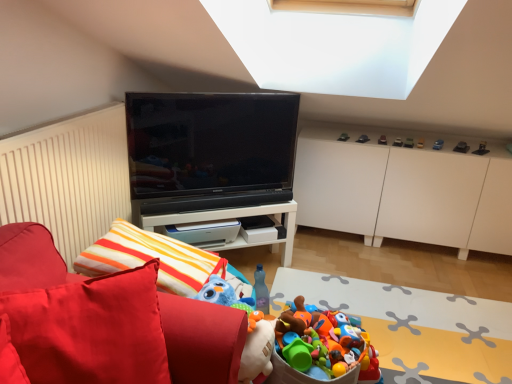
The height and width of the screenshot is (384, 512). Describe the element at coordinates (326, 344) in the screenshot. I see `plastic toy bucket at lower center, the 1th toy positioned from the bottom` at that location.

I want to click on metallic car at upper right, the fifth toy viewed from the right, so click(x=408, y=143).

You are a GUI agent. You are given a task and a screenshot of the screen. Output one action in this format:
    pyautogui.click(x=<x>, y=<y>)
    Task: Click on the metallic silver toy car at upper right, which appears as the ninth toy when ordered from the bottom
    
    Given the screenshot: What is the action you would take?
    pyautogui.click(x=382, y=140)

Where is `white glossy table at center`? This screenshot has width=512, height=384. white glossy table at center is located at coordinates click(233, 218).

The width and height of the screenshot is (512, 384). I want to click on plush blue at center, which appears as the eleventh toy when viewed from the right, so click(x=248, y=321).

Where is `plastic toy bucket at lower center, the 2th toy positioned from the left`? The height and width of the screenshot is (384, 512). plastic toy bucket at lower center, the 2th toy positioned from the left is located at coordinates (326, 344).

Would you say plastic toy bucket at lower center, which is counted as the eleventh toy, starting from the top, is to the left or to the right of metallic red car at upper right, positioned as the 4th toy in top-to-bottom order, in the picture?

In the image, plastic toy bucket at lower center, which is counted as the eleventh toy, starting from the top, appears on the left side of metallic red car at upper right, positioned as the 4th toy in top-to-bottom order.

Can you confirm if plastic toy bucket at lower center, which is counted as the eleventh toy, starting from the top, is wider than metallic red car at upper right, which is the 8th toy from bottom to top?

Indeed, plastic toy bucket at lower center, which is counted as the eleventh toy, starting from the top, has a greater width compared to metallic red car at upper right, which is the 8th toy from bottom to top.

Is plastic toy bucket at lower center, the 1th toy positioned from the bottom, turned away from metallic red car at upper right, arranged as the 6th toy when viewed from the right?

No.

Is plastic toy bucket at lower center, which is the tenth toy in right-to-left order, not close to metallic red car at upper right, arranged as the 6th toy when viewed from the right?

Absolutely, plastic toy bucket at lower center, which is the tenth toy in right-to-left order, is distant from metallic red car at upper right, arranged as the 6th toy when viewed from the right.

From the image's perspective, which one is positioned lower, black glossy tv at center or metallic red car at upper right, positioned as the 4th toy in top-to-bottom order?

From the image's view, black glossy tv at center is below.

From a real-world perspective, starting from the black glossy tv at center, which toy is the 9th one below it? Please provide its 2D coordinates.

[(398, 142)]

From a real-world perspective, is black glossy tv at center on metallic red car at upper right, positioned as the 4th toy in top-to-bottom order?

Indeed, from a real-world perspective, black glossy tv at center stands above metallic red car at upper right, positioned as the 4th toy in top-to-bottom order.

Which of these two, black glossy tv at center or metallic red car at upper right, which is the 8th toy from bottom to top, stands shorter?

metallic red car at upper right, which is the 8th toy from bottom to top.

Choose the correct answer: Is metallic blue car at upper right, marked as the 7th toy in a top-to-bottom arrangement, inside metallic gold car at upper right, which is counted as the 8th toy, starting from the left, or outside it?

metallic blue car at upper right, marked as the 7th toy in a top-to-bottom arrangement, is not inside metallic gold car at upper right, which is counted as the 8th toy, starting from the left, it's outside.

Is point (442, 145) behind point (418, 147)?

Yes, point (442, 145) is farther from viewer.

Considering the relative sizes of metallic blue car at upper right, positioned as the ninth toy in left-to-right order, and metallic gold car at upper right, which is counted as the 8th toy, starting from the left, in the image provided, is metallic blue car at upper right, positioned as the ninth toy in left-to-right order, taller than metallic gold car at upper right, which is counted as the 8th toy, starting from the left,?

Indeed, metallic blue car at upper right, positioned as the ninth toy in left-to-right order, has a greater height compared to metallic gold car at upper right, which is counted as the 8th toy, starting from the left.

Is metallic silver toy car at upper right, the eleventh toy when ordered from bottom to top, completely or partially inside plush blue at center, which appears as the eleventh toy when viewed from the right?

No, plush blue at center, which appears as the eleventh toy when viewed from the right, does not contain metallic silver toy car at upper right, the eleventh toy when ordered from bottom to top.

Looking at the image, does plush blue at center, which is the 2th toy from bottom to top, seem bigger or smaller compared to metallic silver toy car at upper right, which appears as the 1th toy when viewed from the top?

Considering their sizes, plush blue at center, which is the 2th toy from bottom to top, takes up more space than metallic silver toy car at upper right, which appears as the 1th toy when viewed from the top.

Does point (265, 341) lie behind point (341, 135)?

No.

Which object is closer to the camera taking this photo, plush blue at center, which appears as the eleventh toy when viewed from the right, or metallic silver toy car at upper right, which appears as the 1th toy when viewed from the top?

plush blue at center, which appears as the eleventh toy when viewed from the right, is closer to the camera.

Is point (439, 147) positioned in front of point (362, 141)?

Yes, it is.

Can you see metallic blue car at upper right, the 3th toy when ordered from right to left, touching metallic car at upper center, which is the 4th toy from left to right?

No, metallic blue car at upper right, the 3th toy when ordered from right to left, is not with metallic car at upper center, which is the 4th toy from left to right.

From a real-world perspective, is metallic blue car at upper right, the 3th toy when ordered from right to left, located beneath metallic car at upper center, which is the second toy from top to bottom?

No, from a real-world perspective, metallic blue car at upper right, the 3th toy when ordered from right to left, is not beneath metallic car at upper center, which is the second toy from top to bottom.

Considering the sizes of objects black glossy tv at center and metallic car at upper right, positioned as the fifth toy in top-to-bottom order, in the image provided, who is shorter, black glossy tv at center or metallic car at upper right, positioned as the fifth toy in top-to-bottom order,?

metallic car at upper right, positioned as the fifth toy in top-to-bottom order, is shorter.

Consider the image. Does black glossy tv at center touch metallic car at upper right, the fifth toy viewed from the right?

No, black glossy tv at center is not beside metallic car at upper right, the fifth toy viewed from the right.

From the image's perspective, is black glossy tv at center positioned above or below metallic car at upper right, which is counted as the 7th toy, starting from the left?

black glossy tv at center is situated lower than metallic car at upper right, which is counted as the 7th toy, starting from the left, in the image.

In order to click on toy that is the 4th one when counting backward from the black glossy tv at center in this screenshot , I will do `click(408, 143)`.

Is metallic black toy car at upper right, marked as the 9th toy in a top-to-bottom arrangement, at the left side of metallic car at upper right, the fifth toy viewed from the right?

Incorrect, metallic black toy car at upper right, marked as the 9th toy in a top-to-bottom arrangement, is not on the left side of metallic car at upper right, the fifth toy viewed from the right.

Is metallic black toy car at upper right, which ranks as the eleventh toy in left-to-right order, bigger than metallic car at upper right, which is counted as the 7th toy, starting from the left?

Correct, metallic black toy car at upper right, which ranks as the eleventh toy in left-to-right order, is larger in size than metallic car at upper right, which is counted as the 7th toy, starting from the left.

Which of these two, metallic black toy car at upper right, which is the first toy in right-to-left order, or metallic car at upper right, which is counted as the 7th toy, starting from the left, is wider?

metallic black toy car at upper right, which is the first toy in right-to-left order, is wider.

Considering the relative sizes of metallic black toy car at upper right, marked as the 9th toy in a top-to-bottom arrangement, and metallic car at upper right, the fifth toy viewed from the right, in the image provided, is metallic black toy car at upper right, marked as the 9th toy in a top-to-bottom arrangement, taller than metallic car at upper right, the fifth toy viewed from the right,?

Yes.

From a real-world perspective, which toy is the 2nd one above the plastic toy bucket at lower center, the 2th toy positioned from the left? Please provide its 2D coordinates.

[(398, 142)]

Locate an element on the screen. The height and width of the screenshot is (384, 512). the 6th toy behind the black glossy tv at center is located at coordinates (398, 142).

Looking at the image, which one is located closer to metallic silver toy car at upper right, the eleventh toy when ordered from bottom to top, black glossy tv at center or velvet red sofa at left?

The object closer to metallic silver toy car at upper right, the eleventh toy when ordered from bottom to top, is black glossy tv at center.

From the image, which object appears to be nearer to metallic car at upper center, which is the 4th toy from left to right, plastic toy bucket at lower center or metallic gray toy car at upper right, the 2th toy viewed from the right?

metallic gray toy car at upper right, the 2th toy viewed from the right, is closer to metallic car at upper center, which is the 4th toy from left to right.

When comparing their distances from metallic blue car at upper right, marked as the 7th toy in a top-to-bottom arrangement, does metallic gray toy car at upper right, positioned as the 4th toy in bottom-to-top order, or metallic car at upper right, positioned as the fifth toy in top-to-bottom order, seem further?

Based on the image, metallic car at upper right, positioned as the fifth toy in top-to-bottom order, appears to be further to metallic blue car at upper right, marked as the 7th toy in a top-to-bottom arrangement.

Looking at the image, which one is located closer to plastic toy bucket at lower center, which is counted as the eleventh toy, starting from the top, metallic gold car at upper right, the sixth toy in the top-to-bottom sequence, or velvet red sofa at left?

velvet red sofa at left is closer to plastic toy bucket at lower center, which is counted as the eleventh toy, starting from the top.

Which object lies further to the anchor point black glossy tv at center, white glossy table at center or metallic black toy car at upper right, which is the first toy in right-to-left order?

metallic black toy car at upper right, which is the first toy in right-to-left order, is further to black glossy tv at center.

From the image, which object appears to be nearer to metallic blue car at upper right, which is counted as the 5th toy, starting from the bottom, white matte cabinet at upper right or metallic gray toy car at upper right, the eighth toy from the top?

metallic gray toy car at upper right, the eighth toy from the top, lies closer to metallic blue car at upper right, which is counted as the 5th toy, starting from the bottom, than the other object.

Estimate the real-world distances between objects in this image. Which object is closer to metallic silver toy car at upper right, which appears as the ninth toy when ordered from the bottom, metallic gold car at upper right, the sixth toy in the top-to-bottom sequence, or metallic car at upper right, which is counted as the 7th toy, starting from the left?

metallic car at upper right, which is counted as the 7th toy, starting from the left, is positioned closer to the anchor metallic silver toy car at upper right, which appears as the ninth toy when ordered from the bottom.

Based on the photo, which object lies further to the anchor point metallic gray toy car at upper right, the 2th toy viewed from the right, metallic blue car at upper right, which is counted as the 5th toy, starting from the bottom, or plush blue at center, marked as the 1th toy in a left-to-right arrangement?

plush blue at center, marked as the 1th toy in a left-to-right arrangement, lies further to metallic gray toy car at upper right, the 2th toy viewed from the right, than the other object.

Image resolution: width=512 pixels, height=384 pixels. In order to click on television between white glossy table at center and metallic car at upper right, the seventh toy in the bottom-to-top sequence, from left to right in this screenshot , I will do `click(210, 150)`.

I want to click on cabinetry situated between black glossy tv at center and metallic black toy car at upper right, marked as the 9th toy in a top-to-bottom arrangement, from left to right, so click(404, 191).

Locate an element on the screen. The height and width of the screenshot is (384, 512). cabinetry between plastic toy bucket at lower center and metallic red car at upper right, which is the 8th toy from bottom to top, in the front-back direction is located at coordinates (404, 191).

You are a GUI agent. You are given a task and a screenshot of the screen. Output one action in this format:
    pyautogui.click(x=<x>, y=<y>)
    Task: Click on the toy between metallic car at upper right, positioned as the fifth toy in top-to-bottom order, and metallic blue car at upper right, the 3th toy when ordered from right to left, from left to right
    Image resolution: width=512 pixels, height=384 pixels.
    Given the screenshot: What is the action you would take?
    pyautogui.click(x=420, y=143)